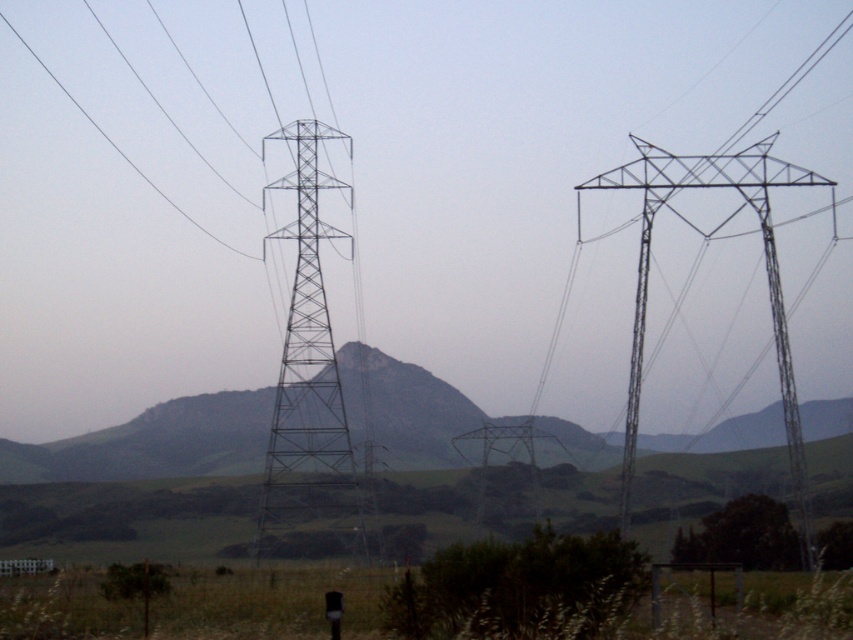
You are standing in the middle of the rural landscape and see the rocky gray mountain at center and the metallic gray tower at center. Which object is positioned to the right of the other?

The rocky gray mountain at center is to the right of the metallic gray tower at center.

You are standing in the rural landscape and want to take a photo of both the rocky gray mountain at center and the metallic silver tower at right. Which object should you adjust your camera focus on first to ensure both are in the frame?

You should focus on the metallic silver tower at right first because the rocky gray mountain at center is further away. By focusing on the closer object, both will be in focus as the depth of field will include the distant mountain.